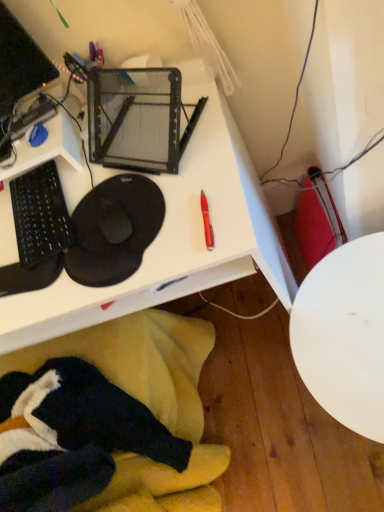
Find the location of `white glossy table at lower right`. white glossy table at lower right is located at coordinates (344, 334).

Describe the element at coordinates (344, 334) in the screenshot. The width and height of the screenshot is (384, 512). I see `white glossy table at lower right` at that location.

You are a GUI agent. You are given a task and a screenshot of the screen. Output one action in this format:
    pyautogui.click(x=<x>, y=<y>)
    Task: Click on the white glossy table at lower right
    
    Given the screenshot: What is the action you would take?
    pyautogui.click(x=344, y=334)

Is velvet-like black swivel chair at lower left shorter than white glossy table at lower right?

No.

From the image's perspective, which object appears higher, velvet-like black swivel chair at lower left or white glossy table at lower right?

From the image's view, white glossy table at lower right is above.

Can you tell me how much velvet-like black swivel chair at lower left and white glossy table at lower right differ in facing direction?

There is a 175-degree angle between the facing directions of velvet-like black swivel chair at lower left and white glossy table at lower right.

Visually, is velvet-like black swivel chair at lower left positioned to the left or to the right of white glossy table at lower right?

In the image, velvet-like black swivel chair at lower left appears on the left side of white glossy table at lower right.

Is velvet-like black swivel chair at lower left placed right next to black matte mouse pad at left?

No, velvet-like black swivel chair at lower left is not next to black matte mouse pad at left.

Is point (156, 510) closer to viewer compared to point (112, 187)?

No, it is behind (112, 187).

From a real-world perspective, which object rests below the other?

velvet-like black swivel chair at lower left is physically lower.

Can you confirm if velvet-like black swivel chair at lower left is positioned to the right of black matte mouse pad at left?

In fact, velvet-like black swivel chair at lower left is to the left of black matte mouse pad at left.

Between white plastic desk at upper center and velvet-like black swivel chair at lower left, which one appears on the right side from the viewer's perspective?

white plastic desk at upper center is more to the right.

Considering the relative sizes of white plastic desk at upper center and velvet-like black swivel chair at lower left in the image provided, is white plastic desk at upper center wider than velvet-like black swivel chair at lower left?

Yes, white plastic desk at upper center is wider than velvet-like black swivel chair at lower left.

In terms of width, does white plastic desk at upper center look wider or thinner when compared to white glossy table at lower right?

In the image, white plastic desk at upper center appears to be wider than white glossy table at lower right.

Consider the image. Is white plastic desk at upper center not near white glossy table at lower right?

That's not correct — white plastic desk at upper center is a little close to white glossy table at lower right.

Does white plastic desk at upper center have a larger size compared to white glossy table at lower right?

Yes, white plastic desk at upper center is bigger than white glossy table at lower right.

Would you say white glossy table at lower right is a long distance from black matte mouse pad at left?

No, white glossy table at lower right is not far from black matte mouse pad at left.

Based on their sizes in the image, would you say white glossy table at lower right is bigger or smaller than black matte mouse pad at left?

white glossy table at lower right is bigger than black matte mouse pad at left.

Is black matte mouse pad at left inside white glossy table at lower right?

No, black matte mouse pad at left is not inside white glossy table at lower right.

Based on the photo, does white glossy table at lower right have a lesser width compared to black matte mouse pad at left?

In fact, white glossy table at lower right might be wider than black matte mouse pad at left.

Which of these two, white plastic desk at upper center or black matte mouse pad at left, is smaller?

Smaller between the two is black matte mouse pad at left.

From their relative heights in the image, would you say white plastic desk at upper center is taller or shorter than black matte mouse pad at left?

In the image, white plastic desk at upper center appears to be taller than black matte mouse pad at left.

From a real-world perspective, does white plastic desk at upper center stand above black matte mouse pad at left?

No, from a real-world perspective, white plastic desk at upper center is not over black matte mouse pad at left

Measure the distance from white plastic desk at upper center to black matte mouse pad at left.

They are 5.36 inches apart.

Is white plastic desk at upper center completely or partially inside velvet-like black swivel chair at lower left?

No.

Considering the positions of objects velvet-like black swivel chair at lower left and white plastic desk at upper center in the image provided, who is more to the left, velvet-like black swivel chair at lower left or white plastic desk at upper center?

velvet-like black swivel chair at lower left is more to the left.

Between velvet-like black swivel chair at lower left and white plastic desk at upper center, which one is positioned in front?

velvet-like black swivel chair at lower left is more forward.

I want to click on swivel chair above the white glossy table at lower right (from a real-world perspective), so click(107, 418).

Locate an element on the screen. The image size is (384, 512). swivel chair below the black matte mouse pad at left (from a real-world perspective) is located at coordinates (107, 418).

When comparing their distances from white glossy table at lower right, does white plastic desk at upper center or black matte mouse pad at left seem further?

The object further to white glossy table at lower right is black matte mouse pad at left.

Looking at this image, which object lies nearer to the anchor point black matte mouse pad at left, white plastic desk at upper center or white glossy table at lower right?

Based on the image, white plastic desk at upper center appears to be nearer to black matte mouse pad at left.

Estimate the real-world distances between objects in this image. Which object is closer to velvet-like black swivel chair at lower left, white plastic desk at upper center or white glossy table at lower right?

Based on the image, white plastic desk at upper center appears to be nearer to velvet-like black swivel chair at lower left.

Considering their positions, is white glossy table at lower right positioned further to white plastic desk at upper center than black matte mouse pad at left?

white glossy table at lower right is further to white plastic desk at upper center.

From the picture: When comparing their distances from white glossy table at lower right, does white plastic desk at upper center or velvet-like black swivel chair at lower left seem closer?

Based on the image, white plastic desk at upper center appears to be nearer to white glossy table at lower right.

Considering their positions, is white plastic desk at upper center positioned further to velvet-like black swivel chair at lower left than black matte mouse pad at left?

black matte mouse pad at left lies further to velvet-like black swivel chair at lower left than the other object.

From the image, which object appears to be farther from white plastic desk at upper center, white glossy table at lower right or velvet-like black swivel chair at lower left?

velvet-like black swivel chair at lower left is positioned further to the anchor white plastic desk at upper center.

Based on their spatial positions, is velvet-like black swivel chair at lower left or white plastic desk at upper center closer to black matte mouse pad at left?

white plastic desk at upper center.

Find the location of `desk located between velvet-like black swivel chair at lower left and white glossy table at lower right in the left-right direction`. desk located between velvet-like black swivel chair at lower left and white glossy table at lower right in the left-right direction is located at coordinates (174, 236).

This screenshot has width=384, height=512. I want to click on sit between velvet-like black swivel chair at lower left and white glossy table at lower right from left to right, so click(114, 230).

This screenshot has width=384, height=512. Find the location of `sit between white plastic desk at upper center and white glossy table at lower right`. sit between white plastic desk at upper center and white glossy table at lower right is located at coordinates (114, 230).

Where is `desk between black matte mouse pad at left and velvet-like black swivel chair at lower left vertically`? This screenshot has height=512, width=384. desk between black matte mouse pad at left and velvet-like black swivel chair at lower left vertically is located at coordinates (174, 236).